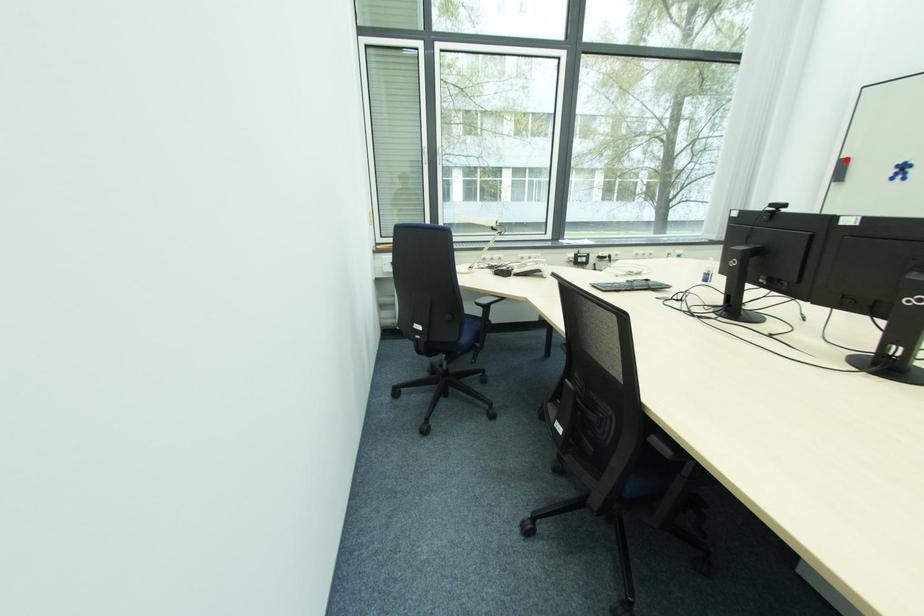
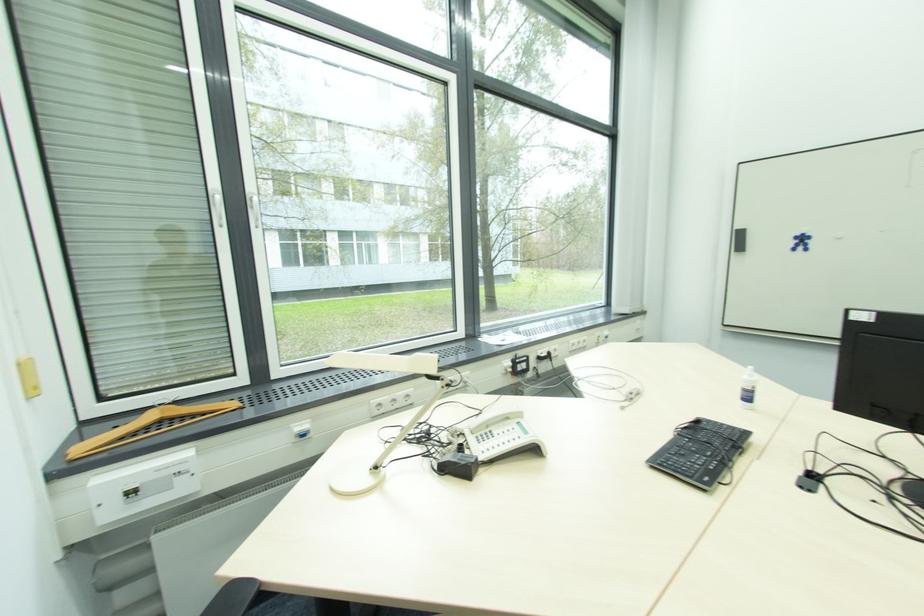
Question: I am providing you with two images of the same scene from different viewpoints. Image1 has a red point marked. In image2, the corresponding 3D location appears at what relative position? Reply with the corresponding letter.

Choices:
 (A) Closer
 (B) Farther

Answer: (A)